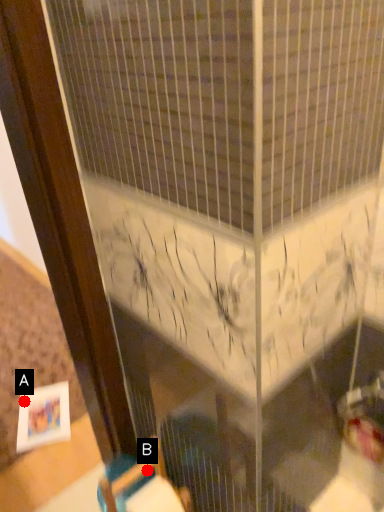
Question: Two points are circled on the image, labeled by A and B beside each circle. Which point is closer to the camera?

Choices:
 (A) A is closer
 (B) B is closer

Answer: (B)